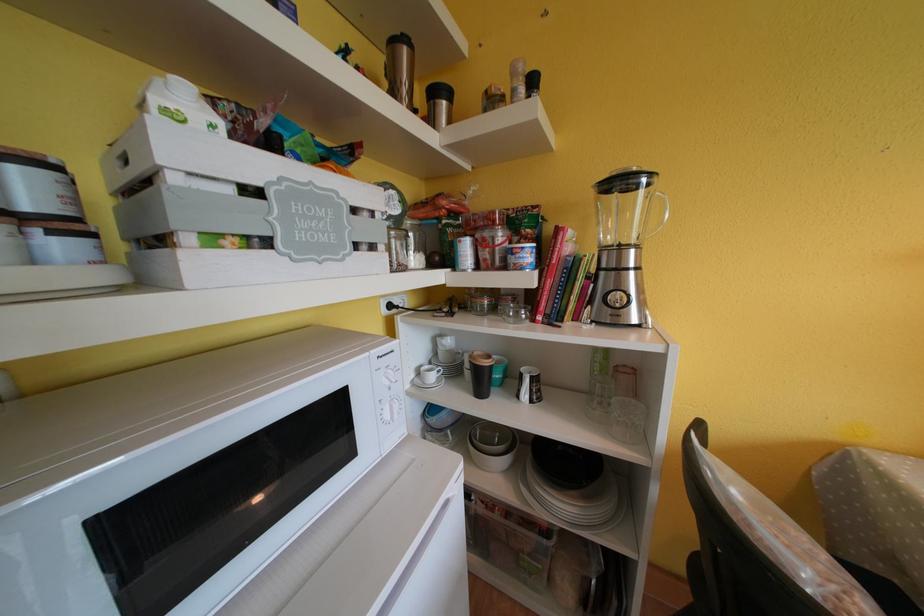
In order to click on blender jug handle in this screenshot , I will do `click(663, 209)`.